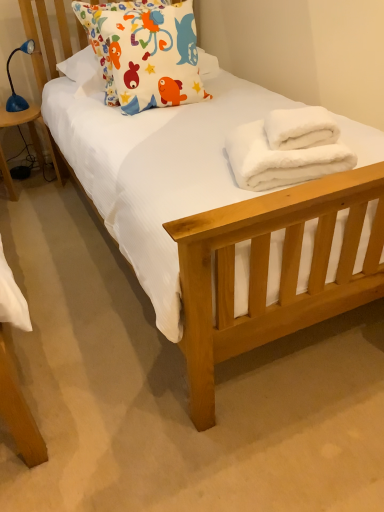
Question: Does blue plastic lamp at left appear on the left side of white fluffy bath towel at center, the second bath towel positioned from the bottom?

Choices:
 (A) yes
 (B) no

Answer: (A)

Question: Are blue plastic lamp at left and white fluffy bath towel at center, the second bath towel positioned from the bottom, located far from each other?

Choices:
 (A) yes
 (B) no

Answer: (A)

Question: Does blue plastic lamp at left come behind white fluffy bath towel at center, the 1th bath towel in the top-to-bottom sequence?

Choices:
 (A) yes
 (B) no

Answer: (A)

Question: Is blue plastic lamp at left oriented towards white fluffy bath towel at center, the 1th bath towel in the top-to-bottom sequence?

Choices:
 (A) no
 (B) yes

Answer: (B)

Question: Can you confirm if blue plastic lamp at left is shorter than white fluffy bath towel at center, the 1th bath towel in the top-to-bottom sequence?

Choices:
 (A) no
 (B) yes

Answer: (A)

Question: Can you confirm if blue plastic lamp at left is taller than white fluffy bath towel at center, the 1th bath towel in the top-to-bottom sequence?

Choices:
 (A) no
 (B) yes

Answer: (B)

Question: Can you confirm if blue plastic lamp at left is taller than blue plastic lamp at left?

Choices:
 (A) yes
 (B) no

Answer: (B)

Question: Is blue plastic lamp at left located within blue plastic lamp at left?

Choices:
 (A) no
 (B) yes

Answer: (A)

Question: Is blue plastic lamp at left turned away from blue plastic lamp at left?

Choices:
 (A) yes
 (B) no

Answer: (B)

Question: From the image's perspective, is blue plastic lamp at left on blue plastic lamp at left?

Choices:
 (A) yes
 (B) no

Answer: (A)

Question: Does blue plastic lamp at left have a larger size compared to blue plastic lamp at left?

Choices:
 (A) no
 (B) yes

Answer: (A)

Question: Does blue plastic lamp at left appear on the left side of blue plastic lamp at left?

Choices:
 (A) no
 (B) yes

Answer: (A)

Question: Is matte fabric pillow at upper left not close to blue plastic lamp at left?

Choices:
 (A) no
 (B) yes

Answer: (A)